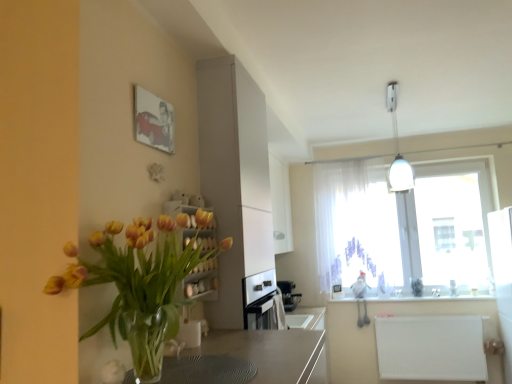
Locate an element on the screen. Image resolution: width=512 pixels, height=384 pixels. blank space situated above white glossy light fixture at upper right (from a real-world perspective) is located at coordinates (394, 96).